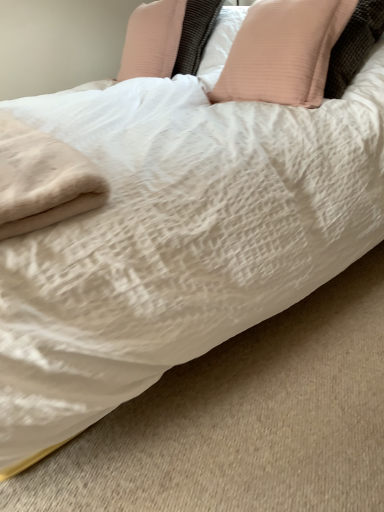
Question: Is point (271, 44) closer or farther from the camera than point (127, 50)?

Choices:
 (A) closer
 (B) farther

Answer: (A)

Question: In terms of height, does pale pink fabric pillow at upper right, marked as the 1th pillow in a right-to-left arrangement, look taller or shorter compared to pink ribbed pillow at upper center, which ranks as the first pillow in left-to-right order?

Choices:
 (A) short
 (B) tall

Answer: (B)

Question: From a real-world perspective, is pale pink fabric pillow at upper right, marked as the 1th pillow in a right-to-left arrangement, above or below pink ribbed pillow at upper center, which ranks as the first pillow in left-to-right order?

Choices:
 (A) below
 (B) above

Answer: (A)

Question: In terms of size, does pink ribbed pillow at upper center, acting as the second pillow starting from the right, appear bigger or smaller than pale pink fabric pillow at upper right, marked as the 1th pillow in a right-to-left arrangement?

Choices:
 (A) big
 (B) small

Answer: (B)

Question: From the image's perspective, is pink ribbed pillow at upper center, which ranks as the first pillow in left-to-right order, located above or below pale pink fabric pillow at upper right, which ranks as the 2th pillow in left-to-right order?

Choices:
 (A) below
 (B) above

Answer: (B)

Question: From a real-world perspective, is pink ribbed pillow at upper center, which ranks as the first pillow in left-to-right order, positioned above or below pale pink fabric pillow at upper right, marked as the 1th pillow in a right-to-left arrangement?

Choices:
 (A) below
 (B) above

Answer: (B)

Question: Does point coord(168,45) appear closer or farther from the camera than point coord(266,40)?

Choices:
 (A) farther
 (B) closer

Answer: (A)